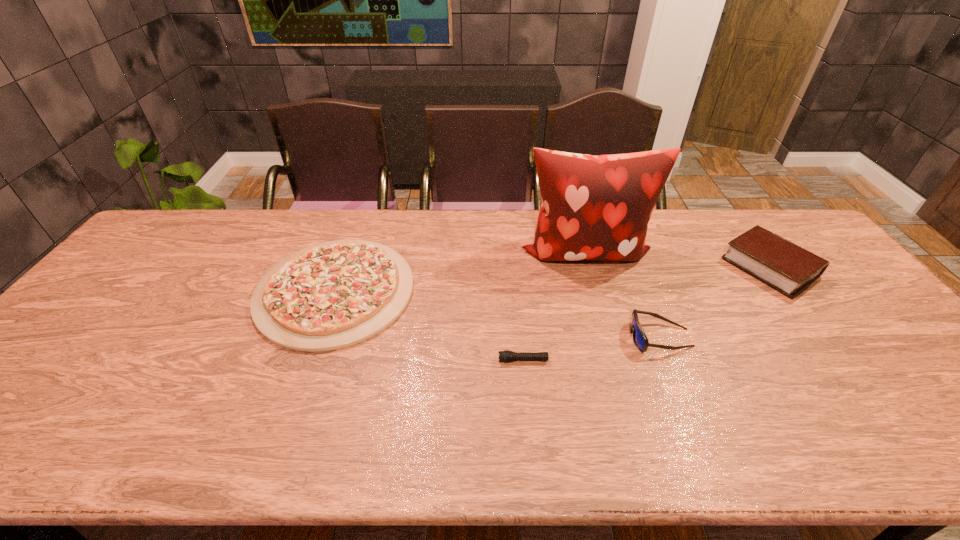
In order to click on free space located on the front-facing side of the sunglasses in this screenshot , I will do `click(481, 338)`.

Where is `vacant space located 0.090m on the back of the leftmost object`? vacant space located 0.090m on the back of the leftmost object is located at coordinates (357, 227).

Where is `vacant area situated 0.160m at the lens end of the flashlight`? The image size is (960, 540). vacant area situated 0.160m at the lens end of the flashlight is located at coordinates (433, 360).

This screenshot has height=540, width=960. I want to click on vacant space located at the lens end of the flashlight, so [380, 360].

Where is `vacant area located 0.150m at the lens end of the flashlight`? vacant area located 0.150m at the lens end of the flashlight is located at coordinates (438, 360).

Where is `cushion present at the far edge`? The image size is (960, 540). cushion present at the far edge is located at coordinates (598, 207).

The width and height of the screenshot is (960, 540). Find the location of `Bible that is positioned at the far edge`. Bible that is positioned at the far edge is located at coordinates (790, 269).

Where is `pizza situated at the far edge`? The image size is (960, 540). pizza situated at the far edge is located at coordinates (329, 296).

Locate an element on the screen. object located in the right edge section of the desktop is located at coordinates (790, 269).

What are the coordinates of `object that is at the far right corner` in the screenshot? It's located at (790, 269).